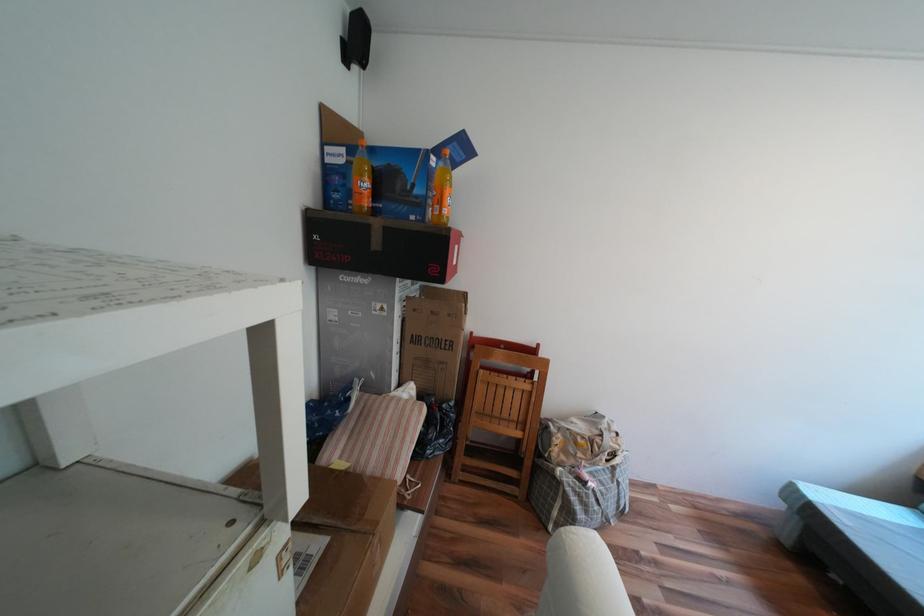
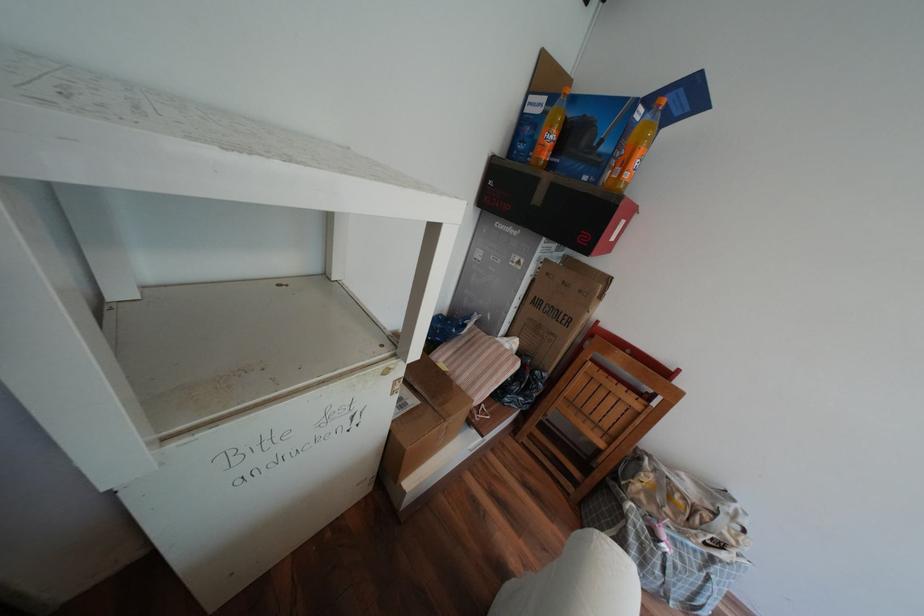
Locate, in the second image, the point that corresponds to the point at 371,175 in the first image.

(561, 127)